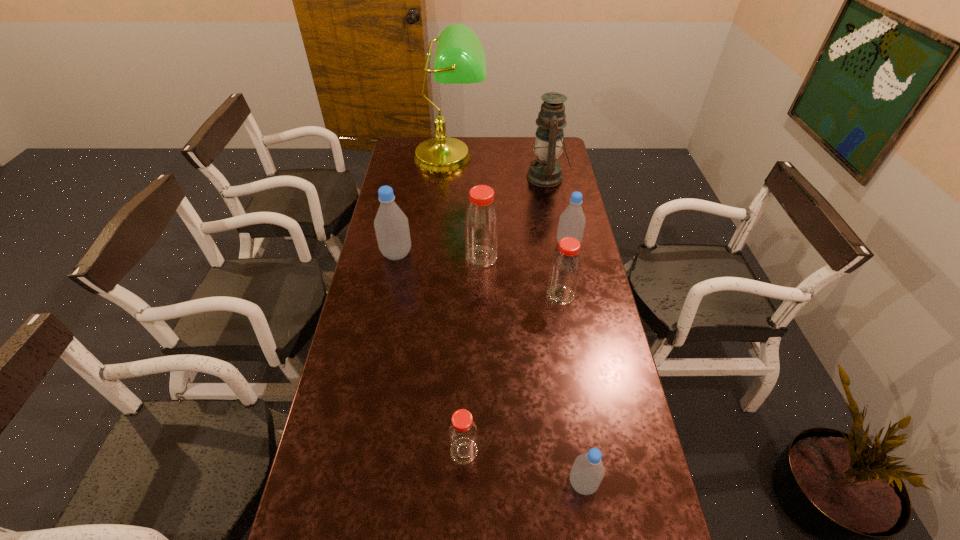
Where is `free space at the left edge`? free space at the left edge is located at coordinates (348, 476).

Find the location of `vacant area at the right edge`. vacant area at the right edge is located at coordinates (598, 414).

Identify the location of vacant space in between the nearest red bottle and the rightmost gray bottle. The height and width of the screenshot is (540, 960). (516, 348).

I want to click on vacant area between the second farthest red bottle and the biggest red bottle, so click(x=521, y=276).

Select which object is the fourth closest to the rightmost red bottle. Please provide its 2D coordinates. Your answer should be formatted as a tuple, i.e. [(x, y)], where the tuple contains the x and y coordinates of a point satisfying the conditions above.

[(462, 434)]

Identify which object is the nearest to the biggest red bottle. Please provide its 2D coordinates. Your answer should be formatted as a tuple, i.e. [(x, y)], where the tuple contains the x and y coordinates of a point satisfying the conditions above.

[(565, 267)]

The height and width of the screenshot is (540, 960). I want to click on bottle that is the second closest to the fourth farthest bottle, so click(481, 223).

Select which bottle is the closest to the second gray bottle from left to right. Please provide its 2D coordinates. Your answer should be formatted as a tuple, i.e. [(x, y)], where the tuple contains the x and y coordinates of a point satisfying the conditions above.

[(462, 434)]

Where is `red bottle that stands as the second closest to the seventh farthest object`? red bottle that stands as the second closest to the seventh farthest object is located at coordinates (481, 223).

Find the location of a particular element. The image size is (960, 540). red bottle that is the second closest to the nearest object is located at coordinates (565, 267).